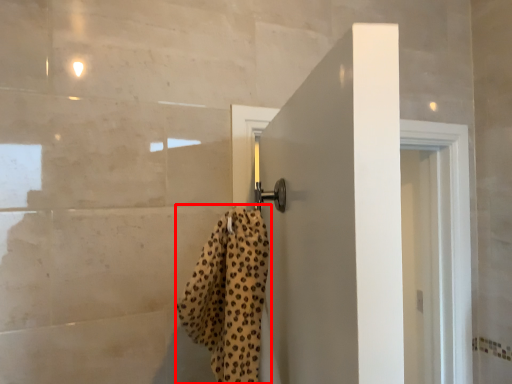
Question: From the image's perspective, what is the correct spatial positioning of bath towel (annotated by the red box) in reference to door?

Choices:
 (A) below
 (B) above

Answer: (B)